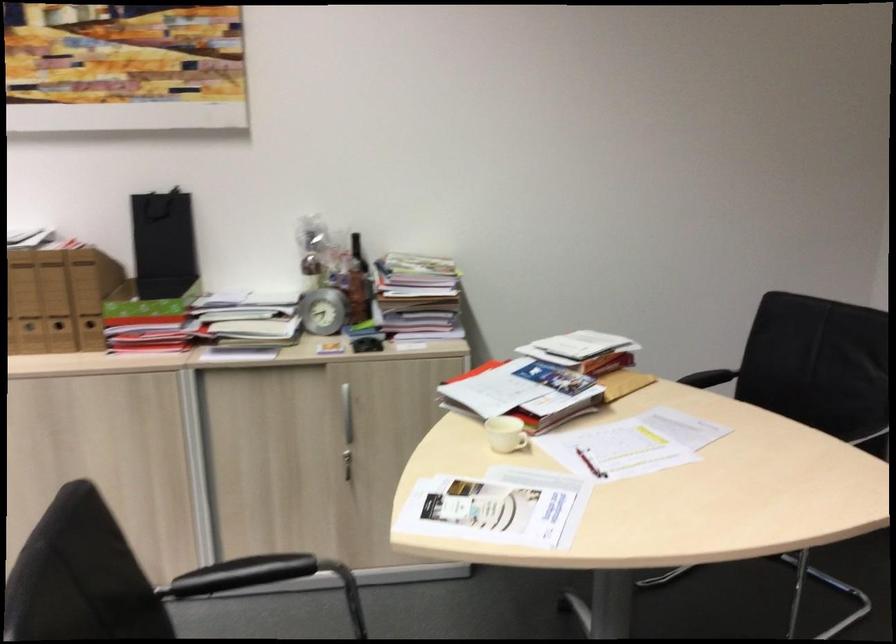
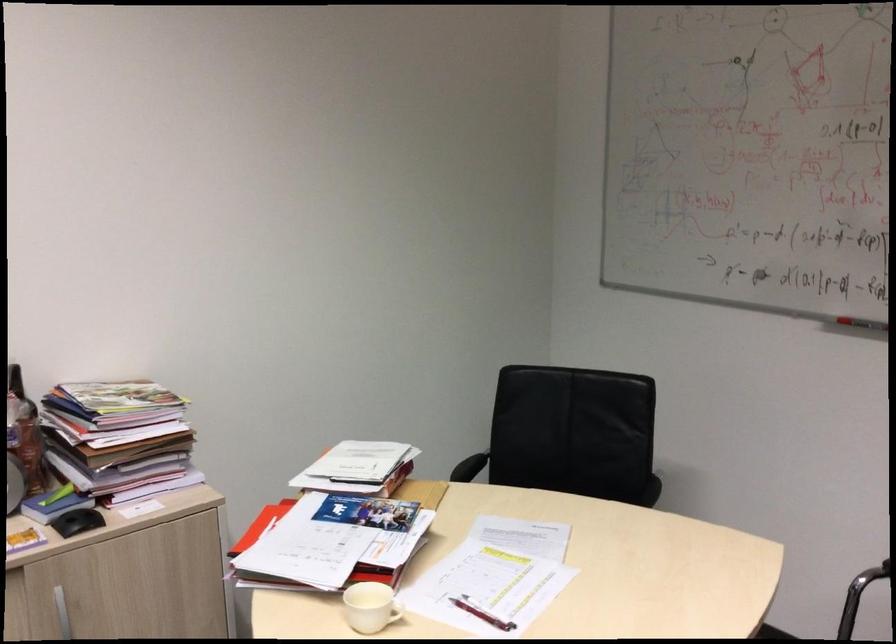
In the second image, find the point that corresponds to point 354,290 in the first image.

(23, 450)